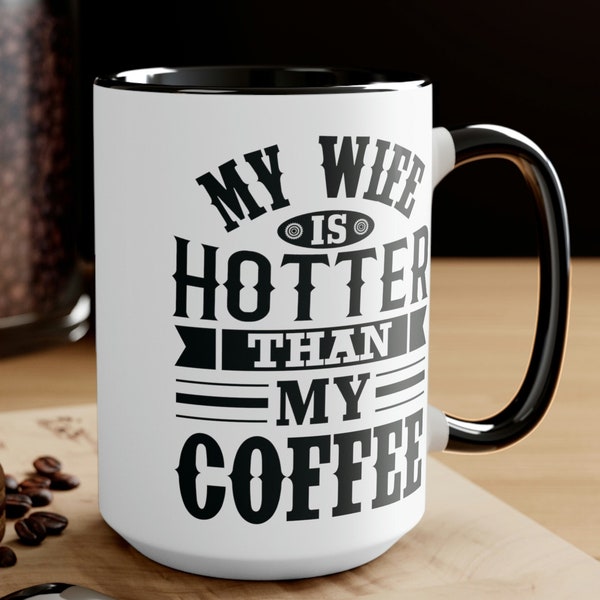
The image size is (600, 600). Find the location of `handle`. handle is located at coordinates (557, 287).